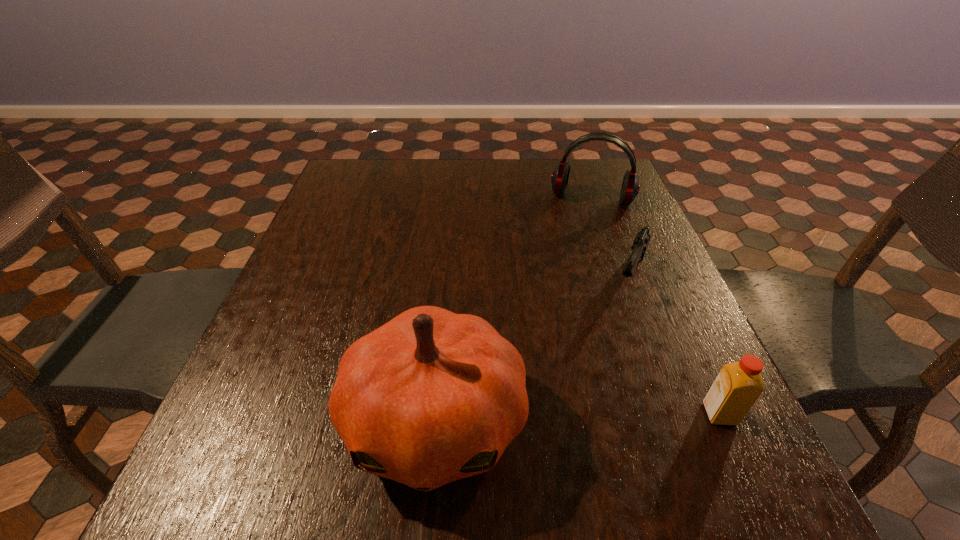
Where is `object located at the near right corner`? The width and height of the screenshot is (960, 540). object located at the near right corner is located at coordinates (737, 387).

This screenshot has width=960, height=540. In the image, there is a desktop. What are the coordinates of `vacant space at the far edge` in the screenshot? It's located at (429, 177).

In the image, there is a desktop. At what (x,y) coordinates should I click in order to perform the action: click on vacant region at the left edge. Please return your answer as a coordinate pair (x, y). Looking at the image, I should click on (334, 225).

Identify the location of vacant space at the right edge of the desktop. (651, 373).

Image resolution: width=960 pixels, height=540 pixels. What are the coordinates of `vacant area at the far left corner of the desktop` in the screenshot? It's located at (375, 160).

In order to click on vacant region at the far right corner in this screenshot , I will do `click(570, 171)`.

Identify the location of vacant space in between the earphone and the second farthest object. (611, 238).

Identify the location of empty space between the third shortest object and the gun. (611, 238).

Locate an element on the screen. This screenshot has height=540, width=960. free spot between the earphone and the gun is located at coordinates (611, 238).

Identify the location of free area in between the orange juice and the second tallest object. (656, 306).